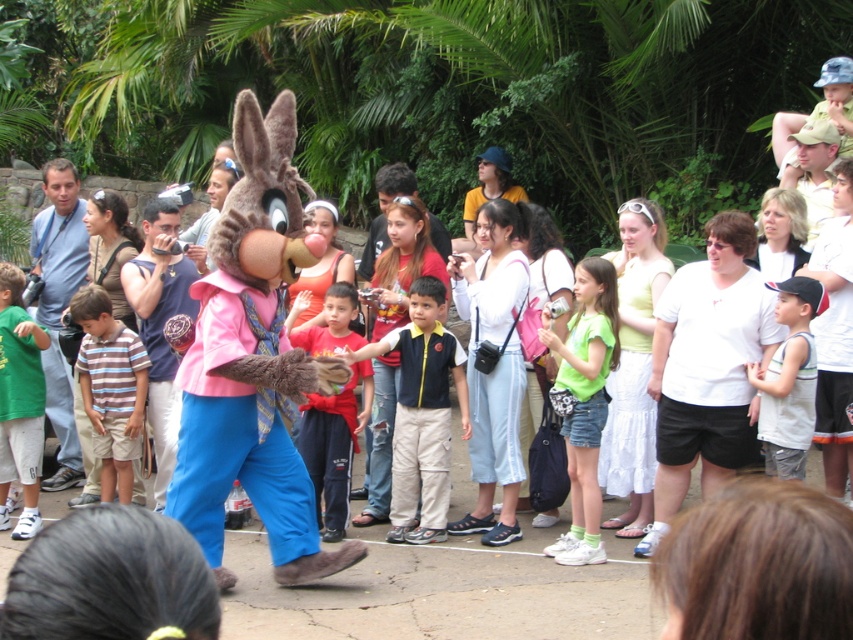
Question: Among these objects, which one is farthest from the camera?

Choices:
 (A) green denim shorts at center
 (B) red cotton shirt at center
 (C) white cotton tank top at center
 (D) velvet plush bunny at center

Answer: (B)

Question: Where is black cotton shirt at center located in relation to white cotton tank top at center in the image?

Choices:
 (A) right
 (B) left

Answer: (B)

Question: From the image, what is the correct spatial relationship of green denim shorts at center in relation to striped cotton shirt at center?

Choices:
 (A) above
 (B) below

Answer: (B)

Question: Which object is closer to the camera taking this photo?

Choices:
 (A) green denim shorts at center
 (B) green cotton shirt at left
 (C) striped cotton shirt at center
 (D) red cotton shirt at center

Answer: (A)

Question: In this image, where is striped cotton shirt at center located relative to red cotton shirt at center?

Choices:
 (A) above
 (B) below

Answer: (A)

Question: Which point is farther to the camera?

Choices:
 (A) (445, 376)
 (B) (786, 282)
 (C) (122, 458)
 (D) (546, 312)

Answer: (C)